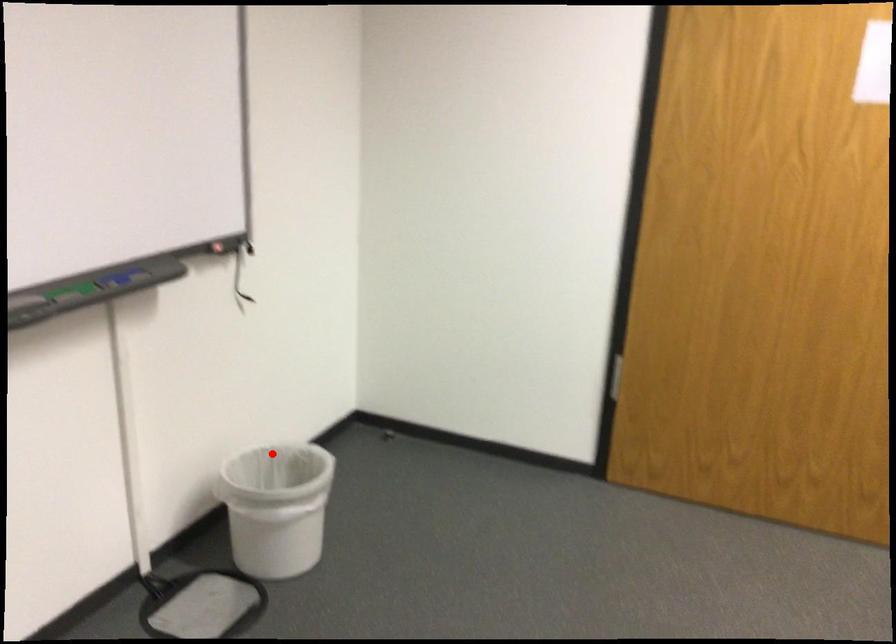
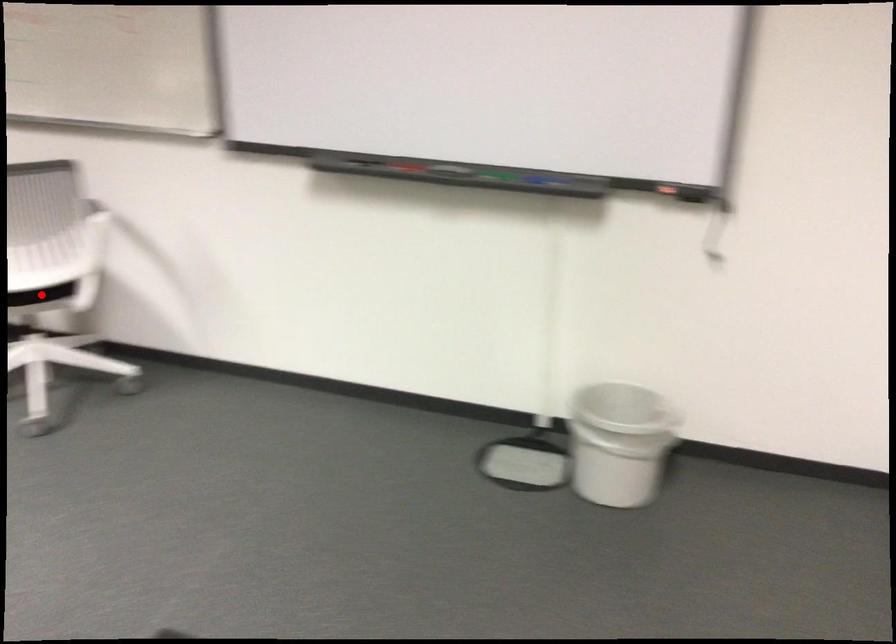
I am providing you with two images of the same scene from different viewpoints. A red point is marked on the first image and another point is marked on the second image. Does the point marked in image1 correspond to the same location as the one in image2?

No